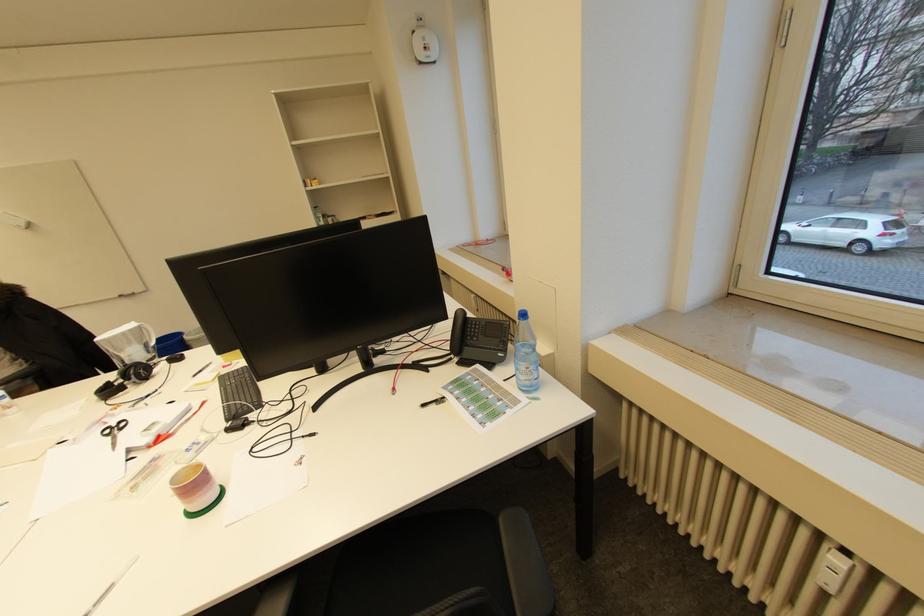
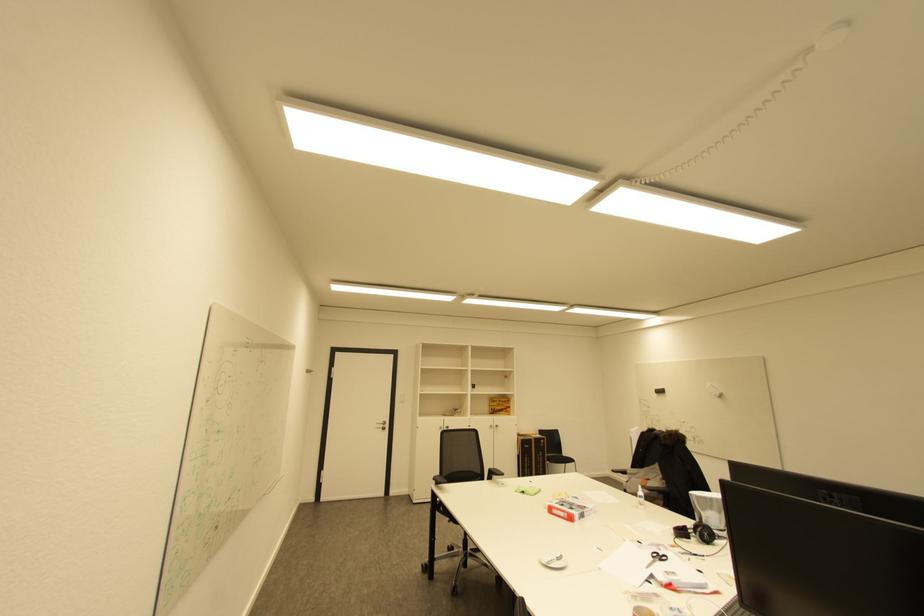
Question: How did the camera likely rotate?

Choices:
 (A) Left
 (B) Right
 (C) Up
 (D) Down

Answer: (A)